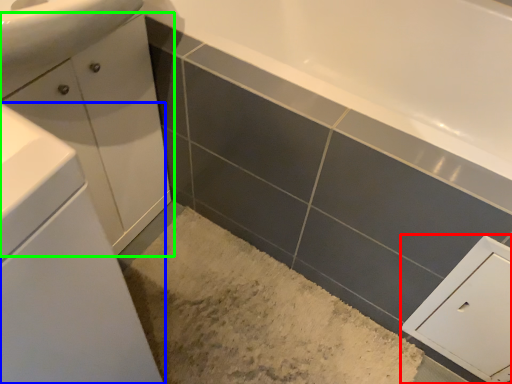
Question: Which object is the closest to the cabinetry (highlighted by a red box)? Choose among these: bathroom cabinet (highlighted by a blue box) or bathroom cabinet (highlighted by a green box).

Choices:
 (A) bathroom cabinet
 (B) bathroom cabinet

Answer: (A)